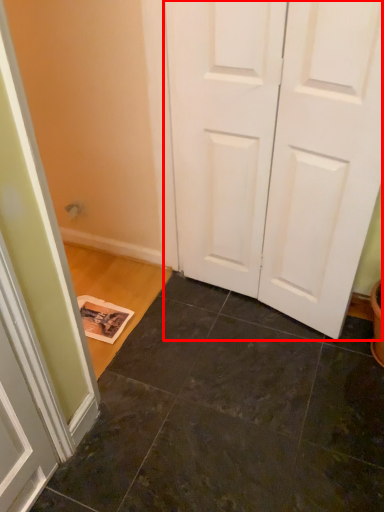
Question: From the image's perspective, where is door (annotated by the red box) located in relation to tile in the image?

Choices:
 (A) below
 (B) above

Answer: (B)